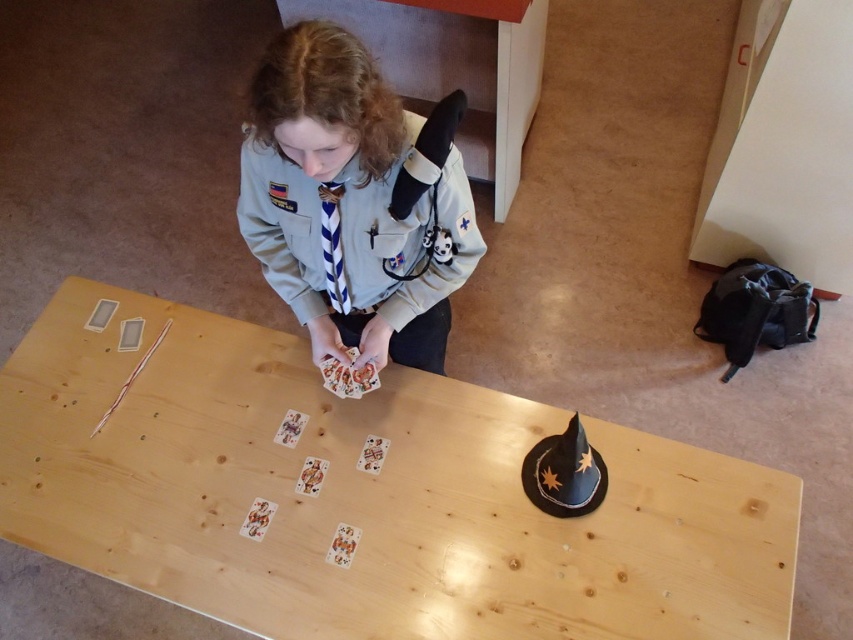
You are standing at the point with coordinates point (x=350, y=282) and want to move to the door located at point (x=726, y=637). Is the door in front of you?

Yes, the door located at point (x=726, y=637) is in front of you because it is positioned in front of point (x=350, y=282).

You are a guest at this scout meeting. You want to place a small gift on the light gray uniform at center so it can be seen by everyone. Is the light wood table at center a good place to put it?

The light wood table at center is below the light gray uniform at center, so placing the gift on the table would not make it visible to everyone since it is lower than the uniform.

You are organizing a scout meeting and need to ensure there is enough space for the light wood table at center and the light gray uniform at center. Based on the scene description, which object takes up more space?

The light wood table at center is larger in size than the light gray uniform at center, so the light wood table at center takes up more space.